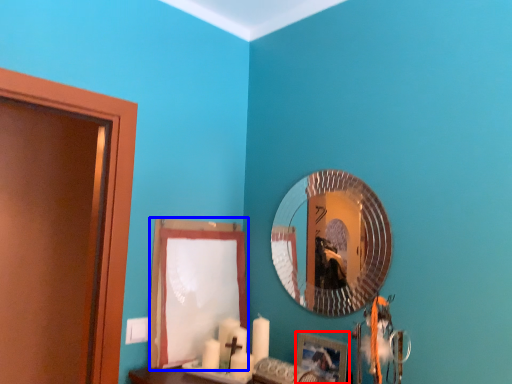
Question: Which object is further to the camera taking this photo, picture frame (highlighted by a red box) or curtain (highlighted by a blue box)?

Choices:
 (A) picture frame
 (B) curtain

Answer: (B)